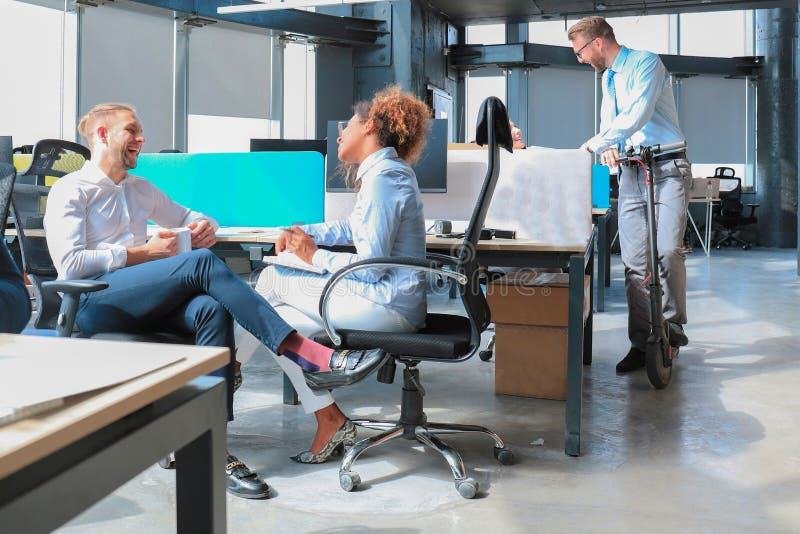
At what (x,y) coordinates should I click in order to perform the action: click on woman sitting in chair. Please return your answer as a coordinate pair (x, y). Looking at the image, I should click on (381, 123), (280, 278), (326, 428), (242, 344), (410, 227).